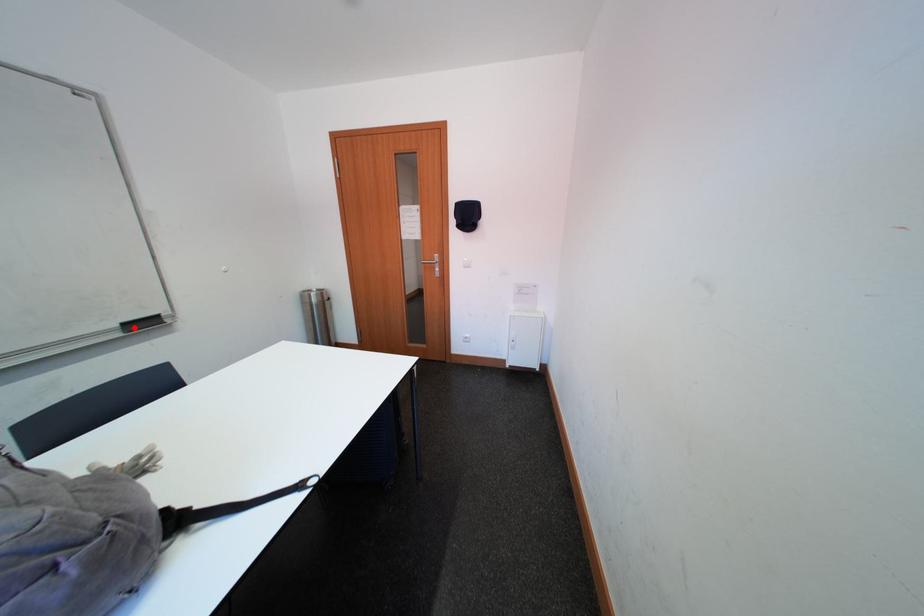
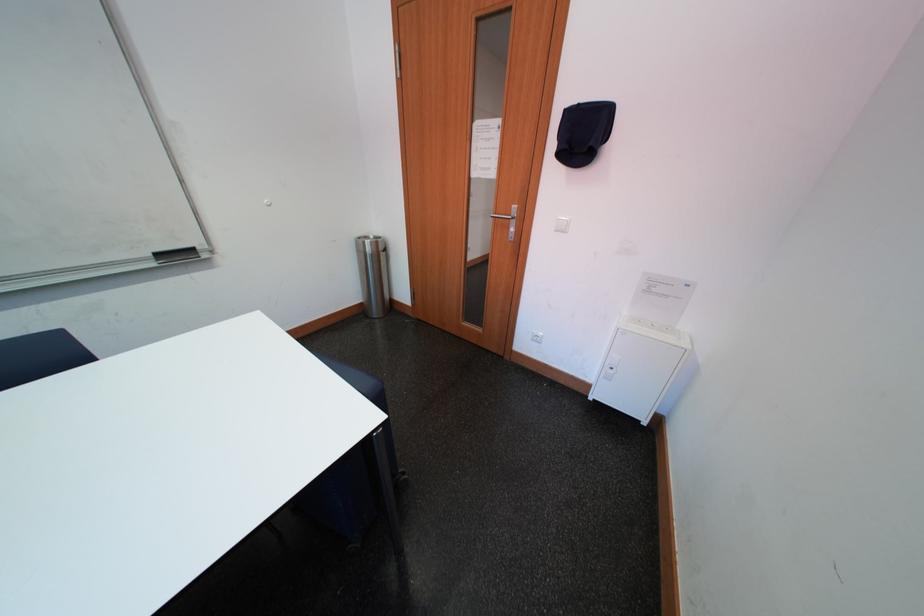
Locate, in the second image, the point that corresponds to the highlighted location in the first image.

(167, 257)